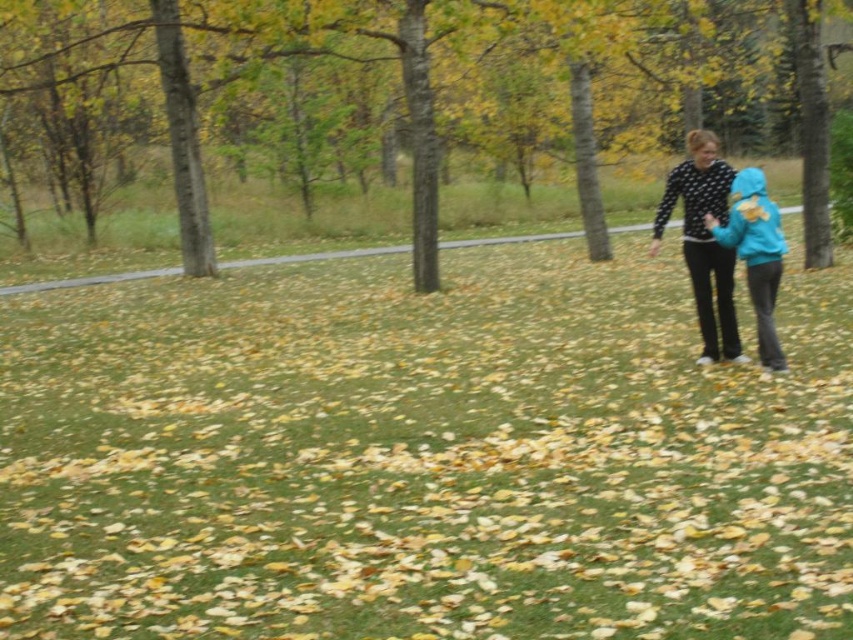
You are a hiker who wants to take a photo of both the brown bark tree at center and the black dotted sweater at right in the same frame. Based on their sizes in the image, which object should you position closer to the camera to ensure both are fully visible?

The brown bark tree at center is taller than the black dotted sweater at right. To include both in the same frame, position the brown bark tree at center closer to the camera so its height doesn

You are a photographer standing in the middle of the grassy area. You want to take a photo of both the black dotted sweater at right and the blue fleece jacket at right in the same frame. Based on their positions, will you be able to capture both subjects without moving your camera?

The black dotted sweater at right is 5.95 feet away from the blue fleece jacket at right. Since the distance between them is less than the camera lens field of view, you can capture both subjects in the same frame without moving the camera.